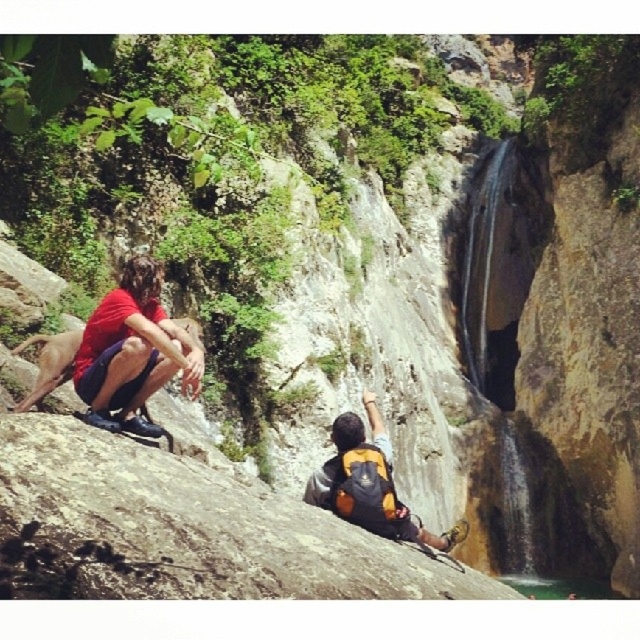
Question: Can you confirm if matte red shirt at left is smaller than yellow-orange backpack at center?

Choices:
 (A) no
 (B) yes

Answer: (B)

Question: Which of the following is the closest to the observer?

Choices:
 (A) 348,442
 (B) 109,378

Answer: (B)

Question: Which point is closer to the camera taking this photo?

Choices:
 (A) (355, 516)
 (B) (193, 387)

Answer: (B)

Question: Does matte red shirt at left come behind yellow-orange backpack at center?

Choices:
 (A) yes
 (B) no

Answer: (B)

Question: Can you confirm if matte red shirt at left is positioned below yellow-orange backpack at center?

Choices:
 (A) yes
 (B) no

Answer: (B)